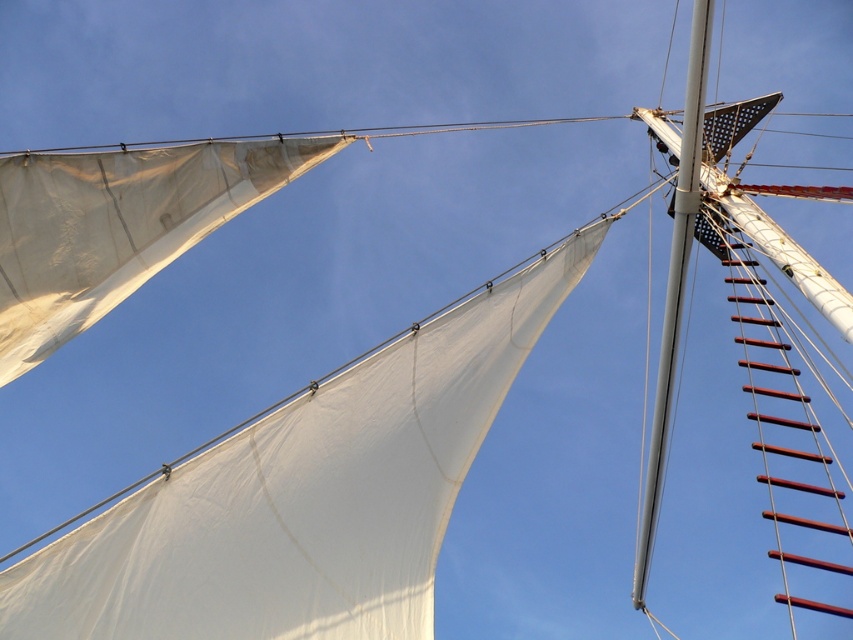
Question: Which point is farther to the camera?

Choices:
 (A) rustic wood ladder at right
 (B) silver metallic mast at upper right

Answer: (A)

Question: From the image, what is the correct spatial relationship of rustic wood ladder at right in relation to silver metallic mast at upper right?

Choices:
 (A) left
 (B) right

Answer: (B)

Question: Can you confirm if rustic wood ladder at right is smaller than silver metallic mast at upper right?

Choices:
 (A) no
 (B) yes

Answer: (A)

Question: Does rustic wood ladder at right appear on the left side of silver metallic mast at upper right?

Choices:
 (A) no
 (B) yes

Answer: (A)